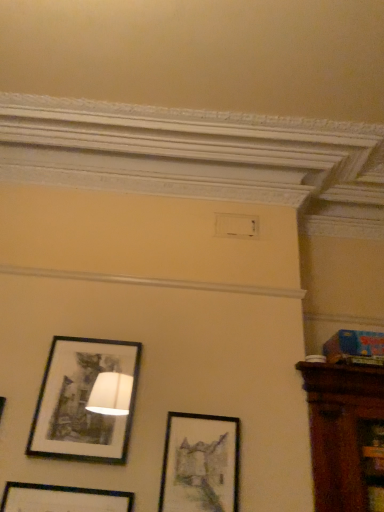
The height and width of the screenshot is (512, 384). Find the location of `matte black picture frame at center, which is the 2th picture frame in left-to-right order`. matte black picture frame at center, which is the 2th picture frame in left-to-right order is located at coordinates (200, 464).

The width and height of the screenshot is (384, 512). What do you see at coordinates (200, 464) in the screenshot?
I see `matte black picture frame at center, which ranks as the 1th picture frame in right-to-left order` at bounding box center [200, 464].

In order to face matte black picture frame at center, which is the 2th picture frame in left-to-right order, should I rotate leftwards or rightwards?

A 1.215 degree turn to the right will do.

The height and width of the screenshot is (512, 384). Describe the element at coordinates (82, 401) in the screenshot. I see `black matte picture frame at upper left, placed as the 2th picture frame when sorted from right to left` at that location.

What are the coordinates of `black matte picture frame at upper left, acting as the 1th picture frame starting from the left` in the screenshot? It's located at (82, 401).

What are the coordinates of `matte black picture frame at center, which is the 2th picture frame in left-to-right order` in the screenshot? It's located at (200, 464).

In the scene shown: Is black matte picture frame at upper left, acting as the 1th picture frame starting from the left, to the left of matte black picture frame at center, which is the 2th picture frame in left-to-right order, from the viewer's perspective?

Indeed, black matte picture frame at upper left, acting as the 1th picture frame starting from the left, is positioned on the left side of matte black picture frame at center, which is the 2th picture frame in left-to-right order.

Is black matte picture frame at upper left, placed as the 2th picture frame when sorted from right to left, positioned behind matte black picture frame at center, which ranks as the 1th picture frame in right-to-left order?

Yes, it is behind matte black picture frame at center, which ranks as the 1th picture frame in right-to-left order.

Considering the positions of point (96, 415) and point (231, 477), is point (96, 415) closer or farther from the camera than point (231, 477)?

Point (96, 415).

Based on the photo, from the image's perspective, relative to matte black picture frame at center, which is the 2th picture frame in left-to-right order, is black matte picture frame at upper left, placed as the 2th picture frame when sorted from right to left, above or below?

black matte picture frame at upper left, placed as the 2th picture frame when sorted from right to left, is situated higher than matte black picture frame at center, which is the 2th picture frame in left-to-right order, in the image.

From a real-world perspective, which object rests below the other?

From a 3D spatial view, matte black picture frame at center, which ranks as the 1th picture frame in right-to-left order, is below.

Considering the relative sizes of black matte picture frame at upper left, placed as the 2th picture frame when sorted from right to left, and matte black picture frame at center, which is the 2th picture frame in left-to-right order, in the image provided, is black matte picture frame at upper left, placed as the 2th picture frame when sorted from right to left, wider than matte black picture frame at center, which is the 2th picture frame in left-to-right order,?

Correct, the width of black matte picture frame at upper left, placed as the 2th picture frame when sorted from right to left, exceeds that of matte black picture frame at center, which is the 2th picture frame in left-to-right order.

Can you confirm if black matte picture frame at upper left, acting as the 1th picture frame starting from the left, is taller than matte black picture frame at center, which is the 2th picture frame in left-to-right order?

Yes, black matte picture frame at upper left, acting as the 1th picture frame starting from the left, is taller than matte black picture frame at center, which is the 2th picture frame in left-to-right order.

Based on their sizes in the image, would you say black matte picture frame at upper left, acting as the 1th picture frame starting from the left, is bigger or smaller than matte black picture frame at center, which is the 2th picture frame in left-to-right order?

black matte picture frame at upper left, acting as the 1th picture frame starting from the left, is bigger than matte black picture frame at center, which is the 2th picture frame in left-to-right order.

Do you think black matte picture frame at upper left, acting as the 1th picture frame starting from the left, is within matte black picture frame at center, which ranks as the 1th picture frame in right-to-left order, or outside of it?

black matte picture frame at upper left, acting as the 1th picture frame starting from the left, cannot be found inside matte black picture frame at center, which ranks as the 1th picture frame in right-to-left order.

Is there a large distance between black matte picture frame at upper left, acting as the 1th picture frame starting from the left, and matte black picture frame at center, which ranks as the 1th picture frame in right-to-left order?

No.

Is black matte picture frame at upper left, placed as the 2th picture frame when sorted from right to left, oriented away from matte black picture frame at center, which ranks as the 1th picture frame in right-to-left order?

No, black matte picture frame at upper left, placed as the 2th picture frame when sorted from right to left, is not facing away from matte black picture frame at center, which ranks as the 1th picture frame in right-to-left order.

Find the location of `picture frame in front of the black matte picture frame at upper left, acting as the 1th picture frame starting from the left`. picture frame in front of the black matte picture frame at upper left, acting as the 1th picture frame starting from the left is located at coordinates (200, 464).

Based on their positions, is matte black picture frame at center, which ranks as the 1th picture frame in right-to-left order, located to the left or right of black matte picture frame at upper left, placed as the 2th picture frame when sorted from right to left?

Clearly, matte black picture frame at center, which ranks as the 1th picture frame in right-to-left order, is on the right of black matte picture frame at upper left, placed as the 2th picture frame when sorted from right to left, in the image.

Does matte black picture frame at center, which ranks as the 1th picture frame in right-to-left order, lie behind black matte picture frame at upper left, acting as the 1th picture frame starting from the left?

No, it is in front of black matte picture frame at upper left, acting as the 1th picture frame starting from the left.

Between point (185, 473) and point (120, 344), which one is positioned in front?

The point (185, 473) is closer to the camera.

From the image's perspective, between matte black picture frame at center, which is the 2th picture frame in left-to-right order, and black matte picture frame at upper left, placed as the 2th picture frame when sorted from right to left, who is located below?

matte black picture frame at center, which is the 2th picture frame in left-to-right order.

In the scene shown: From a real-world perspective, who is located lower, matte black picture frame at center, which is the 2th picture frame in left-to-right order, or black matte picture frame at upper left, placed as the 2th picture frame when sorted from right to left?

matte black picture frame at center, which is the 2th picture frame in left-to-right order.

Which of these two, matte black picture frame at center, which is the 2th picture frame in left-to-right order, or black matte picture frame at upper left, acting as the 1th picture frame starting from the left, is wider?

Wider between the two is black matte picture frame at upper left, acting as the 1th picture frame starting from the left.

Is matte black picture frame at center, which is the 2th picture frame in left-to-right order, taller than black matte picture frame at upper left, acting as the 1th picture frame starting from the left?

Incorrect, the height of matte black picture frame at center, which is the 2th picture frame in left-to-right order, is not larger of that of black matte picture frame at upper left, acting as the 1th picture frame starting from the left.

Who is smaller, matte black picture frame at center, which ranks as the 1th picture frame in right-to-left order, or black matte picture frame at upper left, acting as the 1th picture frame starting from the left?

With smaller size is matte black picture frame at center, which ranks as the 1th picture frame in right-to-left order.

Is matte black picture frame at center, which is the 2th picture frame in left-to-right order, not inside black matte picture frame at upper left, placed as the 2th picture frame when sorted from right to left?

Indeed, matte black picture frame at center, which is the 2th picture frame in left-to-right order, is completely outside black matte picture frame at upper left, placed as the 2th picture frame when sorted from right to left.

Is matte black picture frame at center, which ranks as the 1th picture frame in right-to-left order, next to black matte picture frame at upper left, placed as the 2th picture frame when sorted from right to left?

No, matte black picture frame at center, which ranks as the 1th picture frame in right-to-left order, is not making contact with black matte picture frame at upper left, placed as the 2th picture frame when sorted from right to left.

Is matte black picture frame at center, which ranks as the 1th picture frame in right-to-left order, aimed at black matte picture frame at upper left, acting as the 1th picture frame starting from the left?

No, matte black picture frame at center, which ranks as the 1th picture frame in right-to-left order, is not facing towards black matte picture frame at upper left, acting as the 1th picture frame starting from the left.

Consider the image. How different are the orientations of matte black picture frame at center, which ranks as the 1th picture frame in right-to-left order, and black matte picture frame at upper left, acting as the 1th picture frame starting from the left, in degrees?

The facing directions of matte black picture frame at center, which ranks as the 1th picture frame in right-to-left order, and black matte picture frame at upper left, acting as the 1th picture frame starting from the left, are 0.00378 degrees apart.

Find the location of a particular element. The height and width of the screenshot is (512, 384). picture frame above the matte black picture frame at center, which is the 2th picture frame in left-to-right order (from the image's perspective) is located at coordinates (82, 401).

You are a GUI agent. You are given a task and a screenshot of the screen. Output one action in this format:
    pyautogui.click(x=<x>, y=<y>)
    Task: Click on the picture frame on the left of matte black picture frame at center, which is the 2th picture frame in left-to-right order
    The height and width of the screenshot is (512, 384).
    Given the screenshot: What is the action you would take?
    pyautogui.click(x=82, y=401)

Image resolution: width=384 pixels, height=512 pixels. What are the coordinates of `picture frame behind the matte black picture frame at center, which is the 2th picture frame in left-to-right order` in the screenshot? It's located at (82, 401).